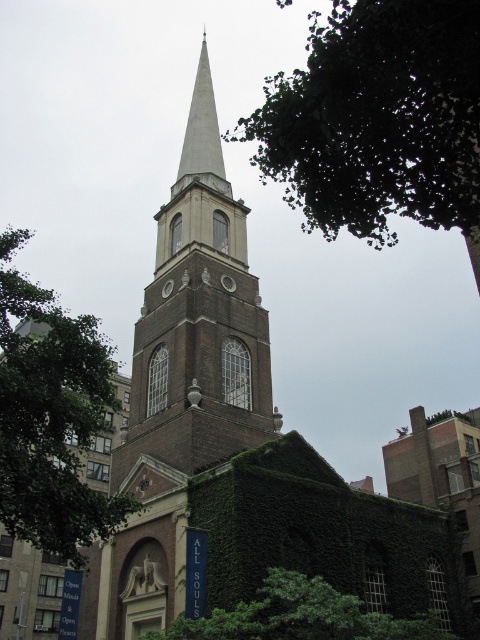
Question: Does brown brick tower at center have a greater width compared to green leafy tree at left?

Choices:
 (A) no
 (B) yes

Answer: (A)

Question: Which object is closer to the camera taking this photo?

Choices:
 (A) green leafy tree at upper center
 (B) green ivy-covered wall at lower center
 (C) brown brick tower at center

Answer: (A)

Question: Which of the following is the farthest from the observer?

Choices:
 (A) green leafy tree at upper center
 (B) green leafy tree at left

Answer: (B)

Question: Can you confirm if brown brick tower at center is positioned above green ivy-covered wall at lower center?

Choices:
 (A) yes
 (B) no

Answer: (A)

Question: Does brown brick tower at center have a greater width compared to green leafy tree at left?

Choices:
 (A) yes
 (B) no

Answer: (B)

Question: Among these points, which one is nearest to the camera?

Choices:
 (A) (188, 257)
 (B) (7, 516)

Answer: (B)